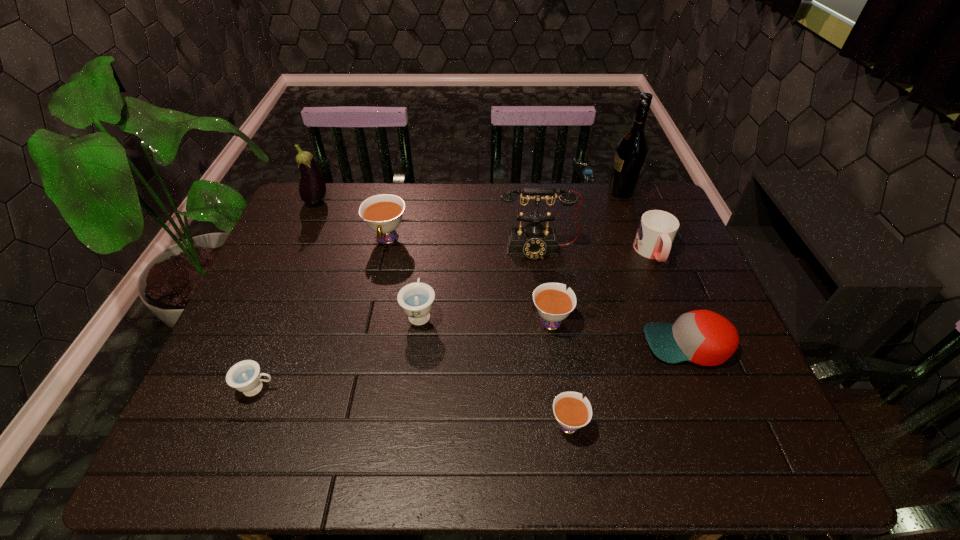
I want to click on the seventh object from right to left, so click(416, 299).

Locate an element on the screen. The image size is (960, 540). the smallest white teacup is located at coordinates (571, 412).

Where is `the nearest white teacup`? This screenshot has height=540, width=960. the nearest white teacup is located at coordinates (571, 412).

What are the coordinates of `the left blue teacup` in the screenshot? It's located at (244, 376).

The image size is (960, 540). What are the coordinates of `the nearer blue teacup` in the screenshot? It's located at (244, 376).

The height and width of the screenshot is (540, 960). What are the coordinates of `vacant area situated 0.190m on the label of the black wine bottle` in the screenshot? It's located at (551, 192).

At what (x,y) coordinates should I click in order to perform the action: click on free space located on the label of the black wine bottle. Please return your answer as a coordinate pair (x, y). The height and width of the screenshot is (540, 960). Looking at the image, I should click on (504, 192).

I want to click on vacant position located 0.110m on the label of the black wine bottle, so click(x=574, y=192).

Locate an element on the screen. The height and width of the screenshot is (540, 960). free spot located on the front of the eggplant is located at coordinates (289, 268).

In order to click on vacant space situated 0.160m on the dial of the black telephone in this screenshot , I will do `click(545, 303)`.